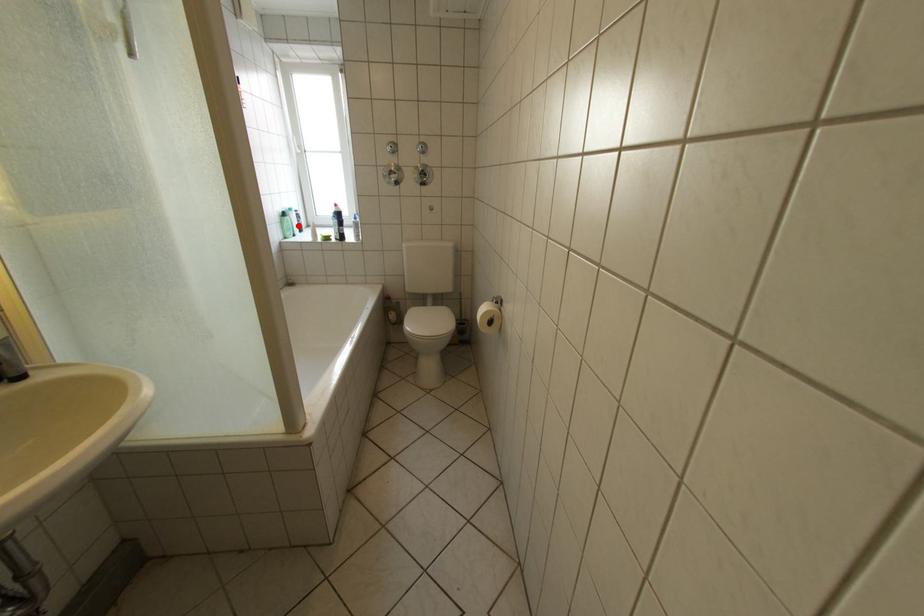
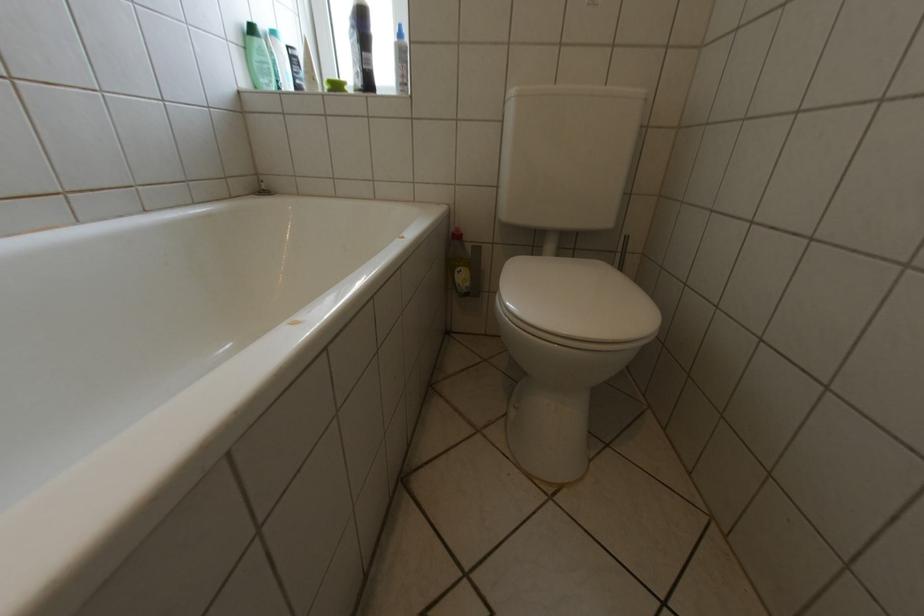
Locate, in the second image, the point that corresponds to the highlighted location in the first image.

(268, 59)